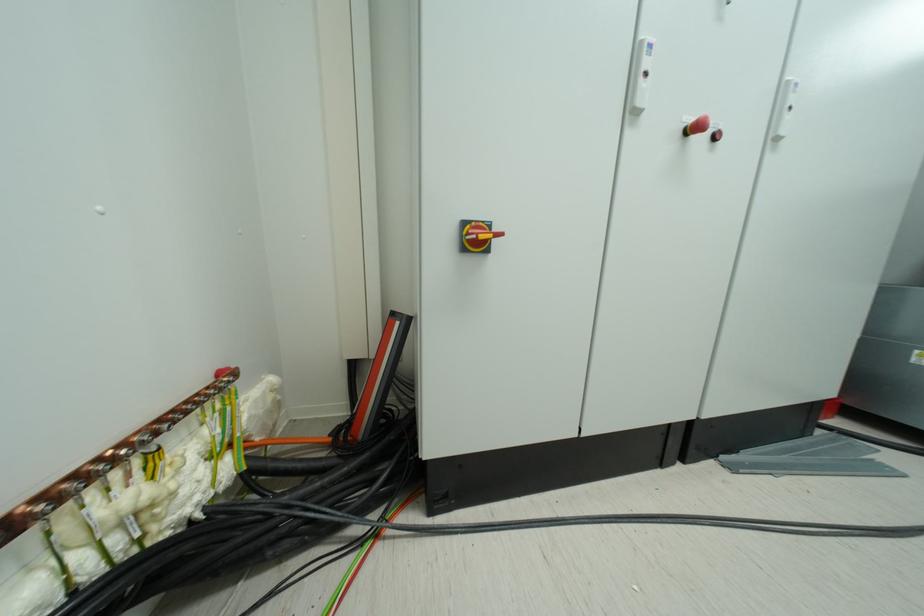
Locate an element on the screen. This screenshot has width=924, height=616. red and yellow switch is located at coordinates (475, 236).